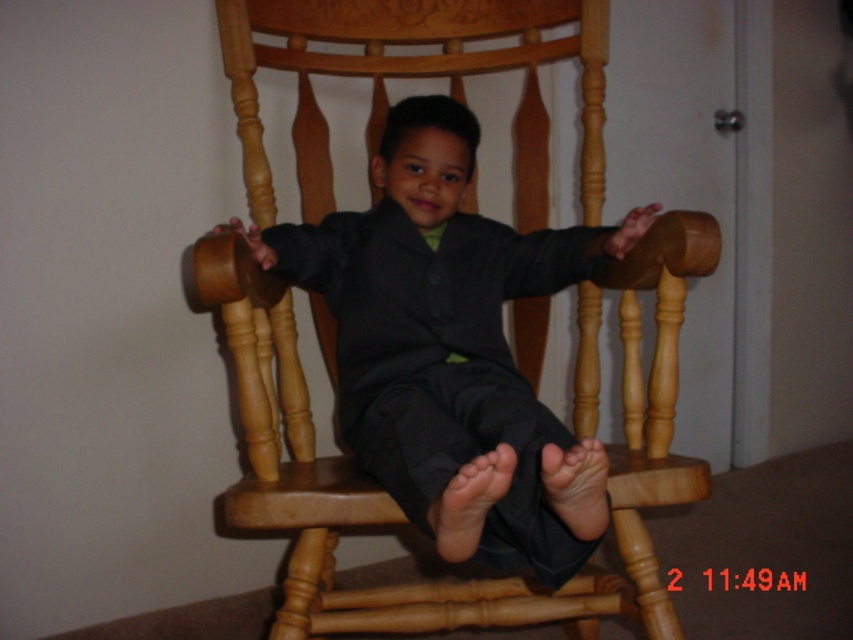
Question: From the image, what is the correct spatial relationship of matte black suit at center in relation to smooth skin foot at center?

Choices:
 (A) right
 (B) left

Answer: (B)

Question: Which of the following is the farthest from the observer?

Choices:
 (A) (456, 534)
 (B) (546, 500)

Answer: (B)

Question: Based on their relative distances, which object is nearer to the smooth skin foot at center?

Choices:
 (A) barefoot at center
 (B) matte black suit at center

Answer: (A)

Question: Does matte black suit at center have a smaller size compared to smooth skin foot at center?

Choices:
 (A) no
 (B) yes

Answer: (A)

Question: Is matte black suit at center bigger than smooth skin foot at center?

Choices:
 (A) yes
 (B) no

Answer: (A)

Question: Which object is the farthest from the barefoot at center?

Choices:
 (A) smooth skin foot at center
 (B) matte black suit at center

Answer: (B)